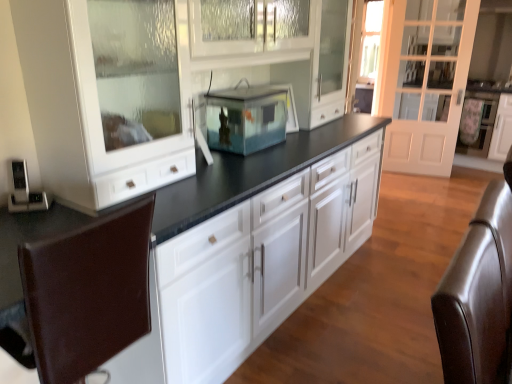
I want to click on vacant point above white glossy cabinet at center (from a real-world perspective), so click(x=408, y=256).